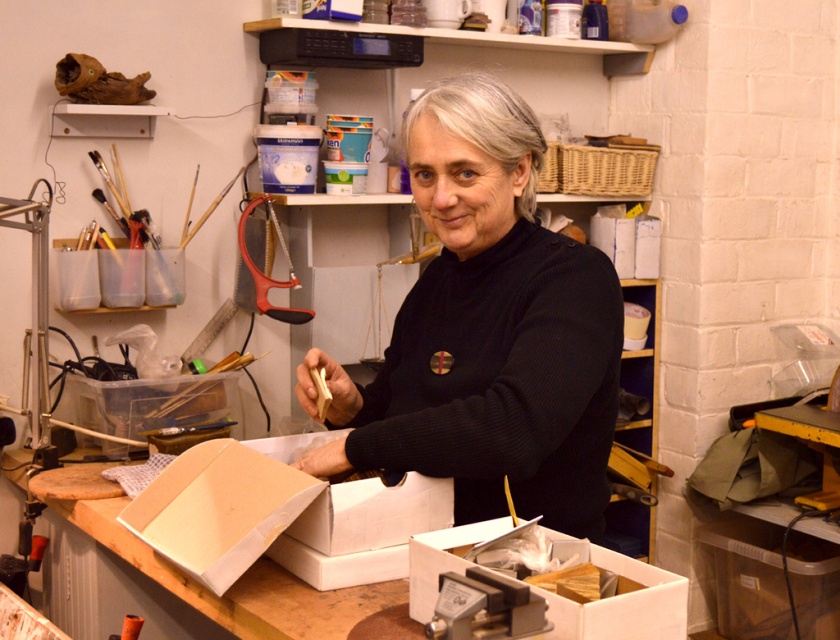
You are organizing items in a workshop and need to place a new item between the black woolen sweater at center and the white cardboard box at lower center. Where should you place it?

The black woolen sweater at center is above the white cardboard box at lower center, so you should place the new item in between them vertically.

You are standing in a workshop and see a point marked at coordinates (399, 536). If you want to reach it without moving your feet, can you estimate if it is within arm reach?

The point at coordinates (399, 536) is 5.19 feet away from you, which is beyond typical arm reach. You would need to move closer to reach it.

You are standing in the workshop and want to place a new tool on the workbench. There are two points marked on the bench where you can place it. Which point is closer to you, point (x=268, y=492) or point (x=307, y=593)?

Point (x=268, y=492) is in front of point (x=307, y=593), so it is closer to you.